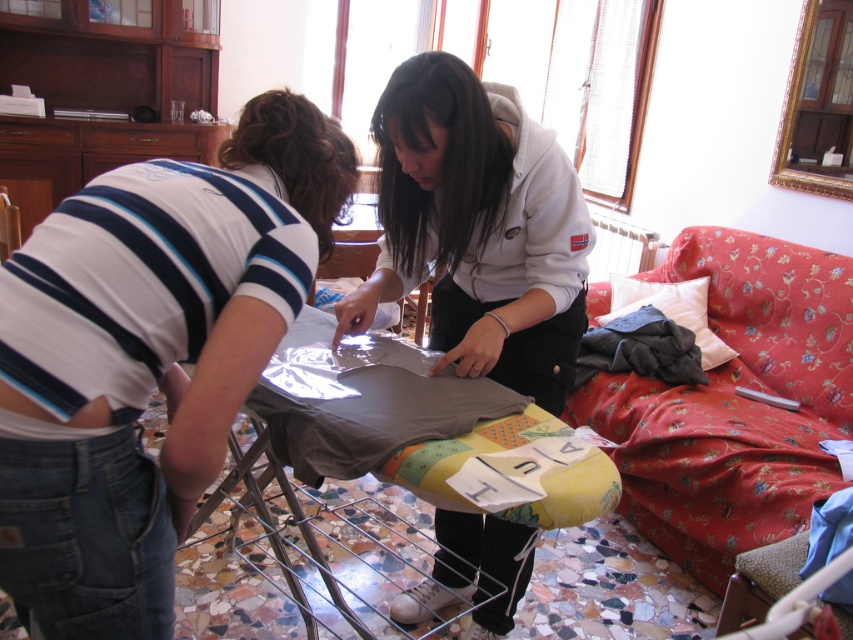
Question: Is matte gray hoodie at center above dark gray fabric at center?

Choices:
 (A) yes
 (B) no

Answer: (A)

Question: Is matte gray hoodie at center to the right of floral fabric couch at right from the viewer's perspective?

Choices:
 (A) no
 (B) yes

Answer: (A)

Question: Which object is the closest to the dark gray fabric at center?

Choices:
 (A) floral fabric couch at right
 (B) white striped shirt at left
 (C) white soft pillow at upper right
 (D) matte gray hoodie at center

Answer: (C)

Question: Which object appears closest to the camera in this image?

Choices:
 (A) white soft pillow at upper right
 (B) dark gray fabric at center

Answer: (B)

Question: Does matte gray hoodie at center come behind white soft pillow at upper right?

Choices:
 (A) no
 (B) yes

Answer: (A)

Question: Which object is closer to the camera taking this photo?

Choices:
 (A) white soft pillow at upper right
 (B) matte gray hoodie at center
 (C) white striped shirt at left

Answer: (C)